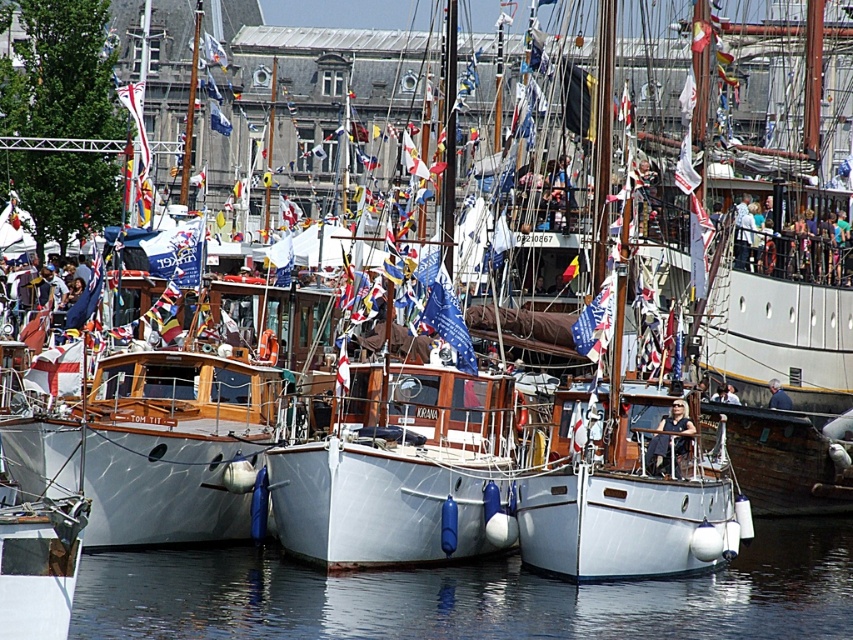
You are a sailor standing on the dock and want to board the white matte boat at center. The dock is at the edge of the transparent water at lower center. Can you safely walk from the dock to the boat without needing a boat?

The distance between the transparent water at lower center and the white matte boat at center is 8.87 meters, so you cannot walk directly to the boat since it is too far away. You would need a boat or another means of transport to reach it.

You are a photographer standing at the edge of the dock. You want to capture a photo of the white matte boat at center without any water in the background. Is the transparent water at lower center positioned in a way that it might interfere with your shot?

The transparent water at lower center might be wider than the white matte boat at center, so there is a possibility that the water could extend beyond the boat in the frame, potentially interfering with the desired composition.